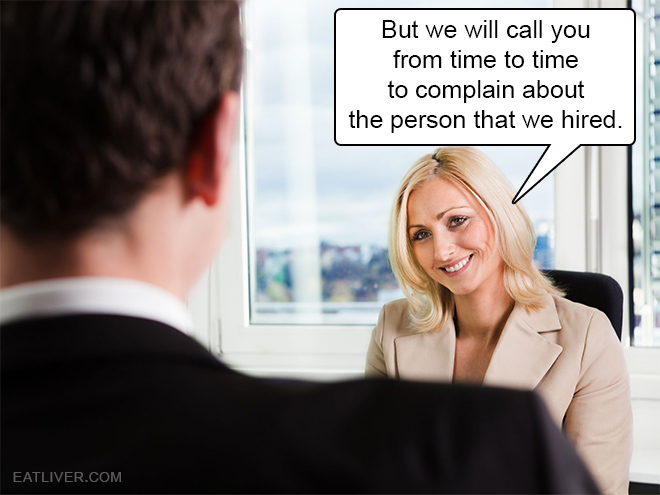
At what (x,y) coordinates should I click in order to perform the action: click on black desk chair. Please return your answer as a coordinate pair (x, y). This screenshot has height=495, width=660. Looking at the image, I should click on (605, 299).